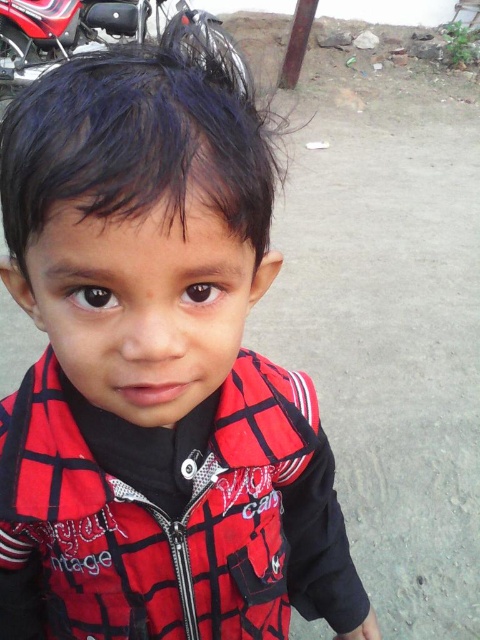
You are a photographer trying to capture a shot of the child in the red plaid jacket at center and the shiny metallic motorcycle at upper left. If you want to frame both subjects so that the jacket and motorcycle are visible in the same photo, would the motorcycle take up more space in the frame compared to the jacket?

The red plaid jacket at center is narrower than the shiny metallic motorcycle at upper left, so the motorcycle would take up more space in the frame compared to the jacket.

What are the coordinates of the red plaid jacket at center?

The coordinates of the red plaid jacket at center are at point (170, 515).

You are a photographer holding a camera. You want to take a photo of the red plaid jacket at center from a distance that allows you to capture the jacket clearly without any distortion. Given that the camera has a minimum focusing distance of 20 inches, will you be able to take the photo as desired?

The red plaid jacket at center and camera are 19.17 inches apart. Since the minimum focusing distance of the camera is 20 inches, the camera cannot focus properly at 19.17 inches. Therefore, you will not be able to take the photo without distortion as the distance is too close.